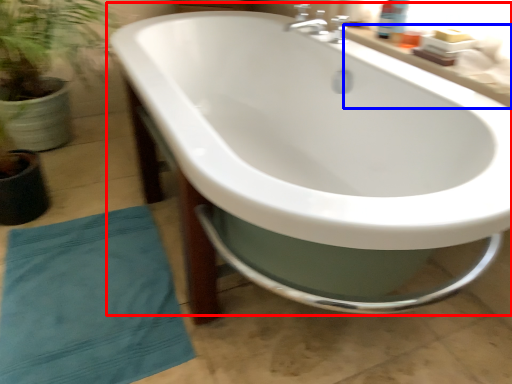
Question: Which object is further to the camera taking this photo, bathtub (highlighted by a red box) or counter top (highlighted by a blue box)?

Choices:
 (A) bathtub
 (B) counter top

Answer: (B)